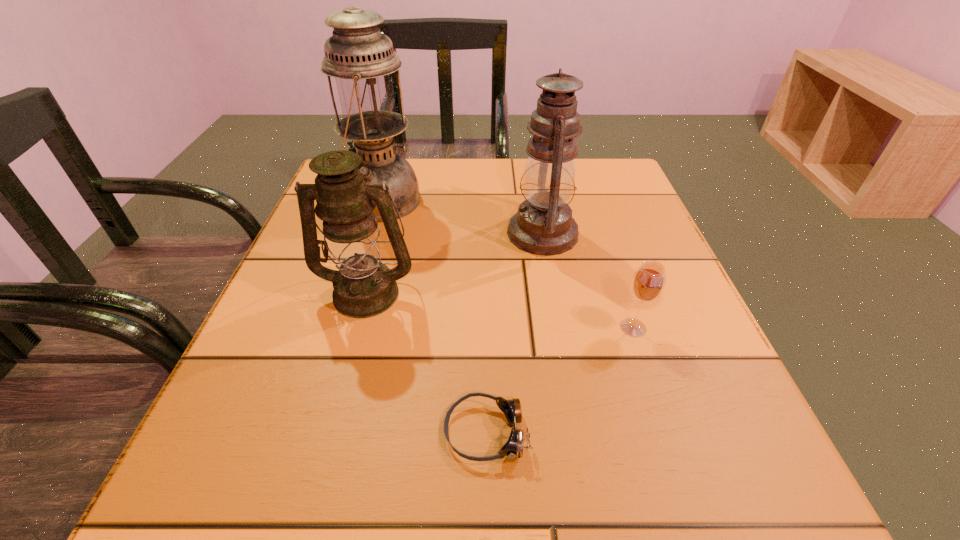
Identify the location of vacant region at the far edge of the desktop. The height and width of the screenshot is (540, 960). (472, 163).

Where is `free location at the near edge of the desktop`? free location at the near edge of the desktop is located at coordinates (613, 457).

At what (x,y) coordinates should I click in order to perform the action: click on vacant space at the left edge of the desktop. Please return your answer as a coordinate pair (x, y). Looking at the image, I should click on (322, 360).

Identify the location of free space at the right edge. This screenshot has width=960, height=540. (683, 373).

I want to click on vacant region between the wineglass and the second tallest oil lamp, so click(588, 280).

I want to click on free space between the wineglass and the rightmost oil lamp, so click(x=588, y=280).

Locate an element on the screen. Image resolution: width=960 pixels, height=540 pixels. vacant point located between the goggles and the second tallest object is located at coordinates (515, 333).

I want to click on free space that is in between the shortest oil lamp and the rightmost object, so click(x=500, y=310).

Where is `unoccupied position between the rightmost object and the third shortest object`? This screenshot has width=960, height=540. unoccupied position between the rightmost object and the third shortest object is located at coordinates (500, 310).

Locate an element on the screen. The image size is (960, 540). free space between the fourth tallest object and the fourth shortest object is located at coordinates (588, 280).